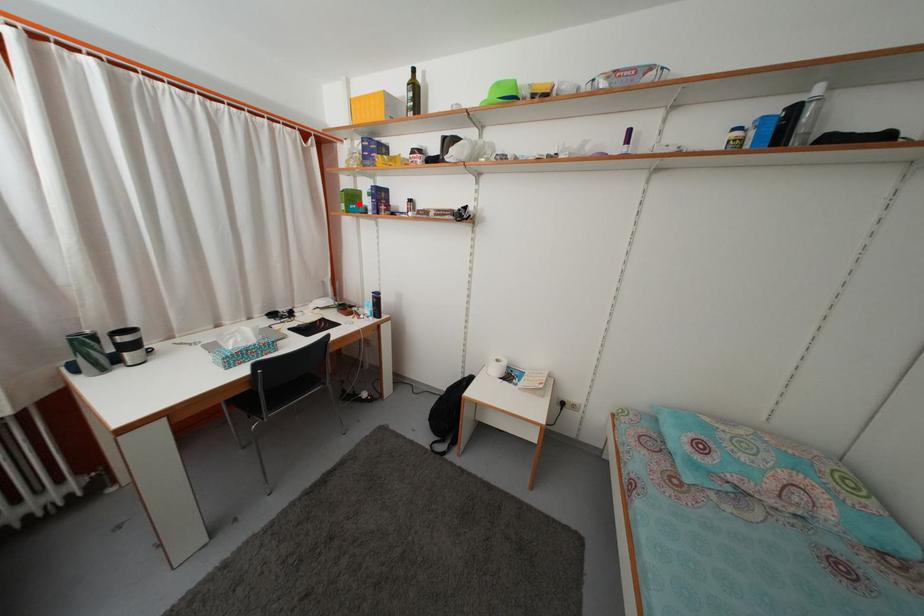
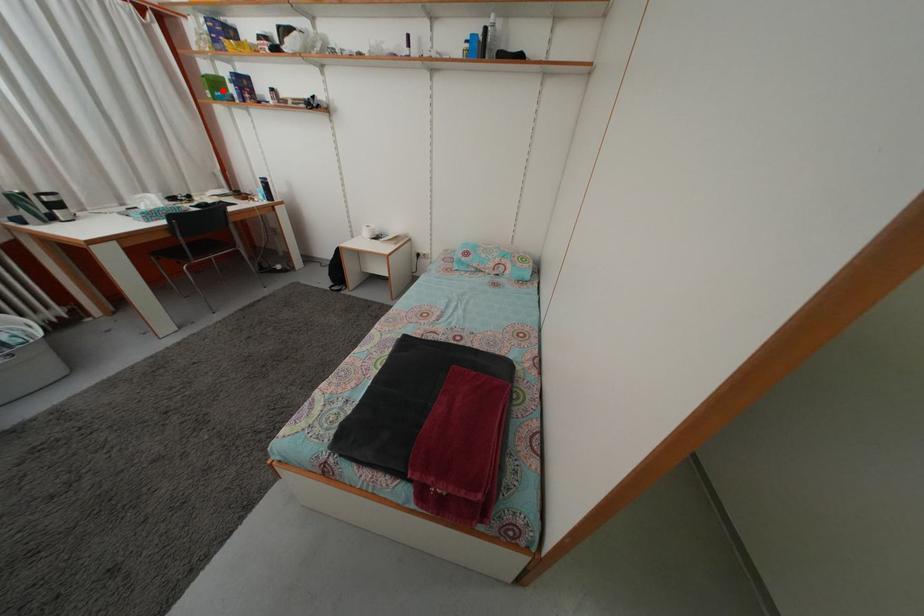
I am providing you with two images of the same scene from different viewpoints. A red point is marked on the first image and another point is marked on the second image. Does the point marked in image1 correspond to the same location as the one in image2?

Yes